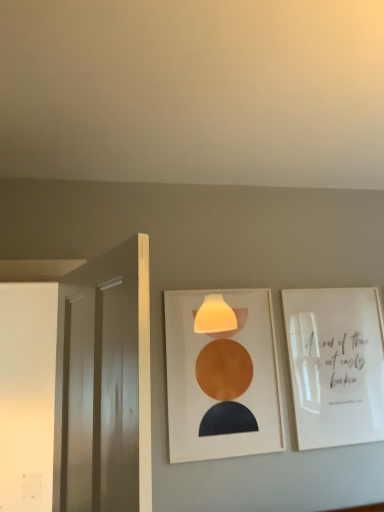
Question: Can we say white glossy picture frame at upper right, the 1th picture frame viewed from the right, lies outside white glossy door at left?

Choices:
 (A) yes
 (B) no

Answer: (A)

Question: Is white glossy picture frame at upper right, the 1th picture frame viewed from the right, at the left side of white glossy door at left?

Choices:
 (A) no
 (B) yes

Answer: (A)

Question: Can you confirm if white glossy picture frame at upper right, which is counted as the 2th picture frame, starting from the left, is shorter than white glossy door at left?

Choices:
 (A) no
 (B) yes

Answer: (B)

Question: From a real-world perspective, is white glossy picture frame at upper right, the 1th picture frame viewed from the right, located higher than white glossy door at left?

Choices:
 (A) no
 (B) yes

Answer: (B)

Question: Are white glossy picture frame at upper right, which is counted as the 2th picture frame, starting from the left, and white glossy door at left beside each other?

Choices:
 (A) yes
 (B) no

Answer: (B)

Question: From a real-world perspective, is white glossy door at left above or below matte white picture frame at center, which appears as the second picture frame when viewed from the right?

Choices:
 (A) below
 (B) above

Answer: (A)

Question: Is point [115, 504] closer or farther from the camera than point [226, 438]?

Choices:
 (A) farther
 (B) closer

Answer: (B)

Question: Based on their sizes in the image, would you say white glossy door at left is bigger or smaller than matte white picture frame at center, which appears as the second picture frame when viewed from the right?

Choices:
 (A) big
 (B) small

Answer: (A)

Question: From the image's perspective, relative to matte white picture frame at center, which appears as the second picture frame when viewed from the right, is white glossy door at left above or below?

Choices:
 (A) below
 (B) above

Answer: (B)

Question: From their relative heights in the image, would you say white glossy picture frame at upper right, the 1th picture frame viewed from the right, is taller or shorter than white glossy door at left?

Choices:
 (A) short
 (B) tall

Answer: (A)

Question: Is white glossy picture frame at upper right, the 1th picture frame viewed from the right, in front of or behind white glossy door at left in the image?

Choices:
 (A) behind
 (B) front

Answer: (A)

Question: From the image's perspective, is white glossy picture frame at upper right, which is counted as the 2th picture frame, starting from the left, above or below white glossy door at left?

Choices:
 (A) above
 (B) below

Answer: (B)

Question: Based on their sizes in the image, would you say white glossy picture frame at upper right, which is counted as the 2th picture frame, starting from the left, is bigger or smaller than white glossy door at left?

Choices:
 (A) small
 (B) big

Answer: (A)

Question: Is white glossy door at left in front of or behind white glossy picture frame at upper right, which is counted as the 2th picture frame, starting from the left, in the image?

Choices:
 (A) behind
 (B) front

Answer: (B)

Question: Is point (109, 298) closer or farther from the camera than point (326, 394)?

Choices:
 (A) farther
 (B) closer

Answer: (B)